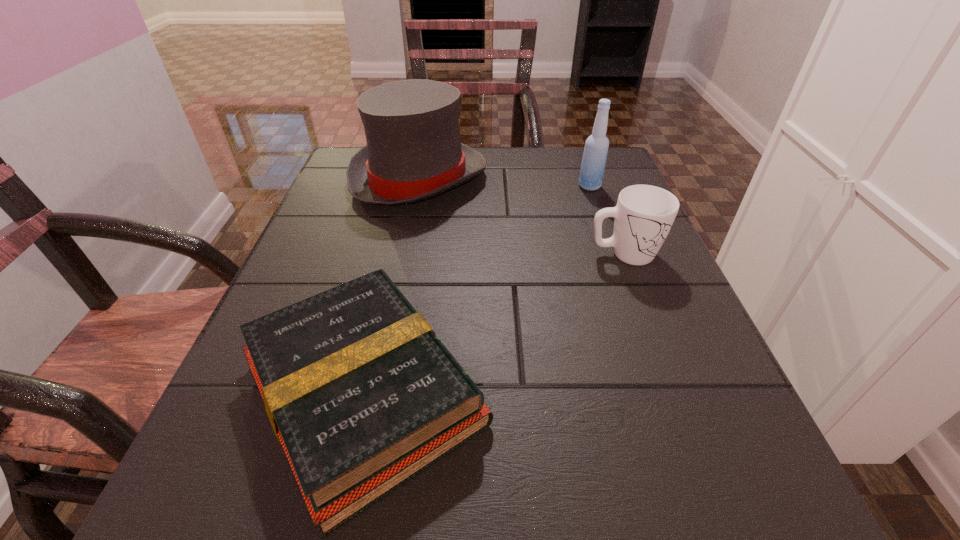
You are a GUI agent. You are given a task and a screenshot of the screen. Output one action in this format:
    pyautogui.click(x=<x>, y=<y>)
    Task: Click on the dress hat at the far edge
    
    Given the screenshot: What is the action you would take?
    pyautogui.click(x=414, y=152)

Where is `object positioned at the near edge`? The width and height of the screenshot is (960, 540). object positioned at the near edge is located at coordinates (362, 395).

The image size is (960, 540). I want to click on dress hat located in the left edge section of the desktop, so click(x=414, y=152).

You are a GUI agent. You are given a task and a screenshot of the screen. Output one action in this format:
    pyautogui.click(x=<x>, y=<y>)
    Task: Click on the hardback book that is at the left edge
    This screenshot has height=540, width=960.
    Given the screenshot: What is the action you would take?
    pyautogui.click(x=362, y=395)

Locate an element on the screen. This screenshot has height=540, width=960. bottle located at the right edge is located at coordinates (594, 158).

This screenshot has height=540, width=960. Find the location of `mug positioned at the right edge`. mug positioned at the right edge is located at coordinates (644, 214).

Where is `object at the far left corner`? The image size is (960, 540). object at the far left corner is located at coordinates (414, 152).

This screenshot has height=540, width=960. Identify the location of object that is at the near left corner. (362, 395).

Locate an element on the screen. object that is at the far right corner is located at coordinates (594, 158).

Find the location of a particular element. vacant space at the far edge of the desktop is located at coordinates (461, 187).